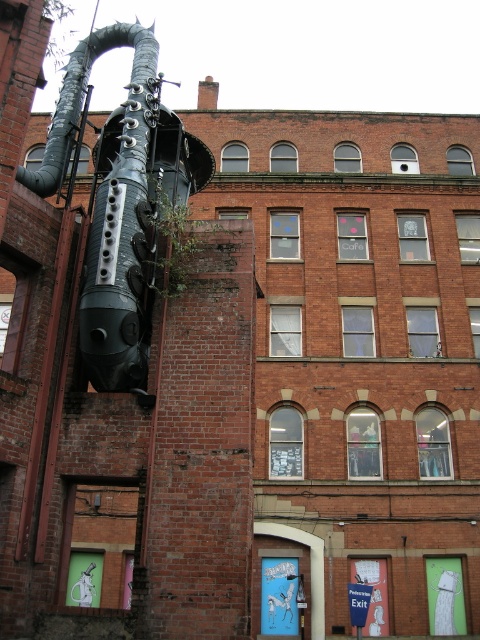
You are an art student analyzing the sculpture in front of the brick building. You notice two black matte pipes on the sculpture. Which one is closer to you, the black matte pipe at left or the black matte pipe at upper left?

The black matte pipe at left is closer to you because the black matte pipe at upper left is positioned behind it.

You are an architect analyzing the sculpture and building. You notice two black matte pipes on the sculpture. Which one is taller? The black matte pipe at left or the black matte pipe at upper left?

The black matte pipe at left is much taller than the black matte pipe at upper left according to the description.